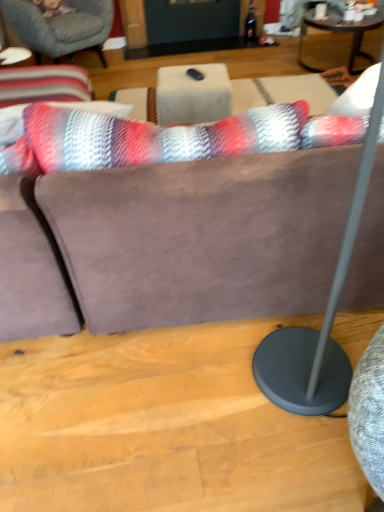
Question: Does white marble table at center have a lesser height compared to striped fabric cushion at upper left?

Choices:
 (A) yes
 (B) no

Answer: (A)

Question: Considering the relative positions of white marble table at center and striped fabric cushion at upper left in the image provided, is white marble table at center to the right of striped fabric cushion at upper left from the viewer's perspective?

Choices:
 (A) no
 (B) yes

Answer: (B)

Question: From the image's perspective, does white marble table at center appear higher than striped fabric cushion at upper left?

Choices:
 (A) yes
 (B) no

Answer: (B)

Question: Is white marble table at center smaller than striped fabric cushion at upper left?

Choices:
 (A) yes
 (B) no

Answer: (A)

Question: Is white marble table at center placed right next to striped fabric cushion at upper left?

Choices:
 (A) yes
 (B) no

Answer: (B)

Question: Relative to striped fabric cushion at upper left, is white marble table at center in front or behind?

Choices:
 (A) behind
 (B) front

Answer: (B)

Question: In terms of height, does white marble table at center look taller or shorter compared to striped fabric cushion at upper left?

Choices:
 (A) tall
 (B) short

Answer: (B)

Question: From the image's perspective, is white marble table at center above or below striped fabric cushion at upper left?

Choices:
 (A) above
 (B) below

Answer: (B)

Question: Looking at the image, does white marble table at center seem bigger or smaller compared to striped fabric cushion at upper left?

Choices:
 (A) small
 (B) big

Answer: (A)

Question: Is dark brown wooden coffee table at upper right wider or thinner than matte gray floor lamp at right?

Choices:
 (A) wide
 (B) thin

Answer: (A)

Question: From the image's perspective, is dark brown wooden coffee table at upper right located above or below matte gray floor lamp at right?

Choices:
 (A) above
 (B) below

Answer: (A)

Question: Considering the positions of dark brown wooden coffee table at upper right and matte gray floor lamp at right in the image, is dark brown wooden coffee table at upper right bigger or smaller than matte gray floor lamp at right?

Choices:
 (A) big
 (B) small

Answer: (B)

Question: Is dark brown wooden coffee table at upper right inside or outside of matte gray floor lamp at right?

Choices:
 (A) outside
 (B) inside

Answer: (A)

Question: Considering the positions of point (344, 353) and point (193, 96), is point (344, 353) closer or farther from the camera than point (193, 96)?

Choices:
 (A) farther
 (B) closer

Answer: (B)

Question: Considering the positions of matte gray floor lamp at right and white marble table at center in the image, is matte gray floor lamp at right bigger or smaller than white marble table at center?

Choices:
 (A) big
 (B) small

Answer: (A)